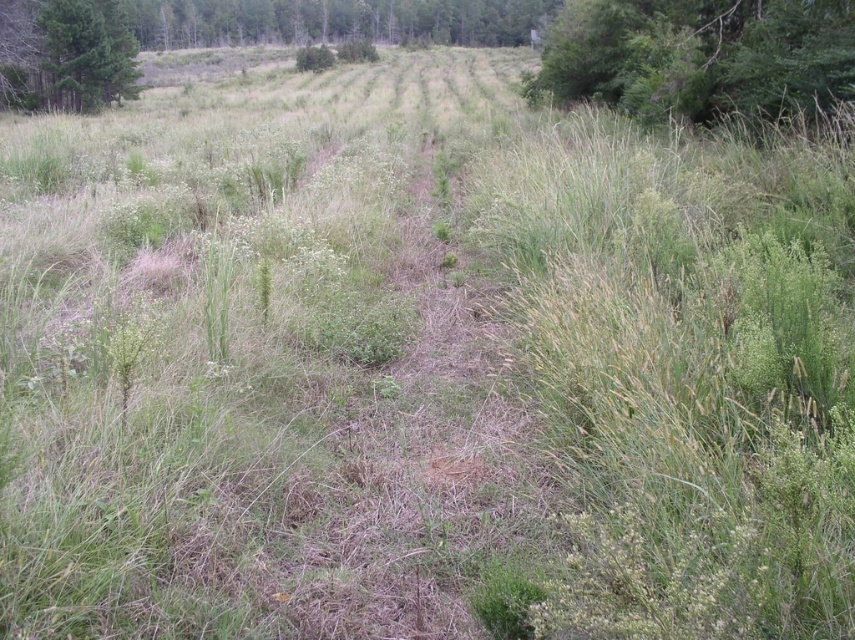
Looking at this image, is green leafy tree at upper right shorter than green matte tree at upper left?

In fact, green leafy tree at upper right may be taller than green matte tree at upper left.

Who is shorter, green leafy tree at upper right or green matte tree at upper left?

green matte tree at upper left is shorter.

Where is `green leafy tree at upper right`? Image resolution: width=855 pixels, height=640 pixels. green leafy tree at upper right is located at coordinates (699, 54).